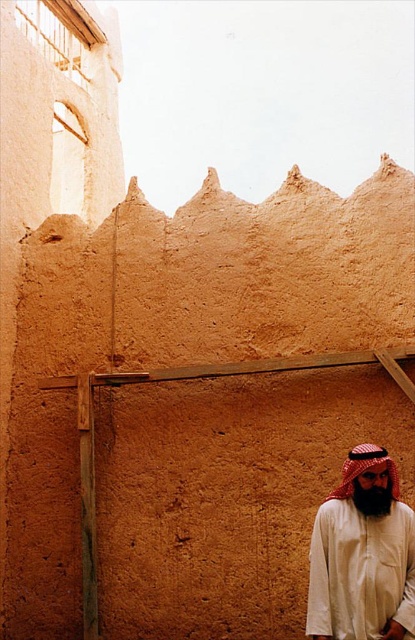
Between white matte headscarf at lower right and red checkered fabric at lower right, which one has more height?

white matte headscarf at lower right is taller.

The image size is (415, 640). I want to click on white matte headscarf at lower right, so click(x=363, y=554).

Identify the location of white matte headscarf at lower right. This screenshot has width=415, height=640. (363, 554).